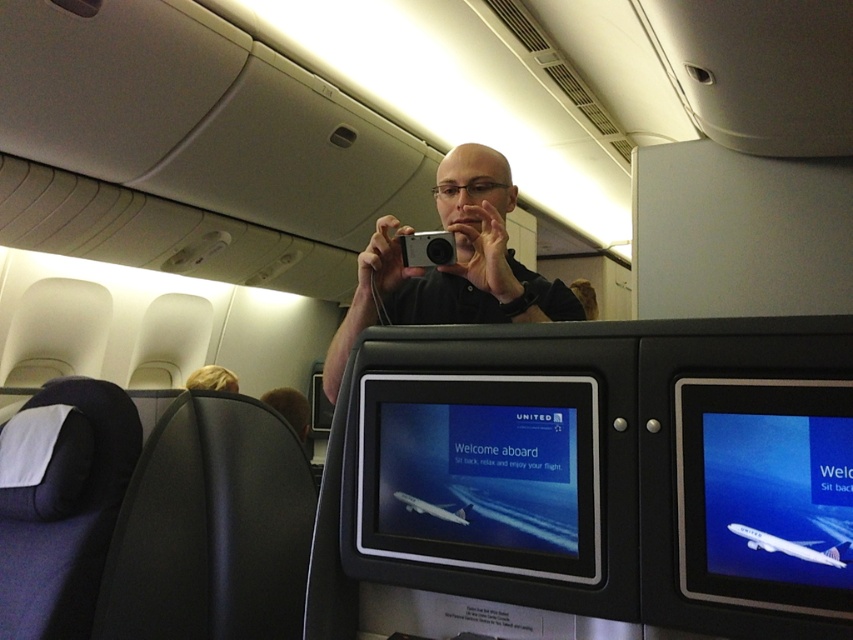
Question: Among these objects, which one is nearest to the camera?

Choices:
 (A) silver metallic camera at center
 (B) black matte camera at center
 (C) blue glossy airplane at center
 (D) white glossy airplane at upper center

Answer: (C)

Question: Does black matte camera at center have a lesser width compared to white glossy airplane at upper center?

Choices:
 (A) yes
 (B) no

Answer: (B)

Question: Which point is closer to the camera?

Choices:
 (A) silver metallic camera at center
 (B) blue glossy screen at center
 (C) white glossy airplane at center

Answer: (B)

Question: Can you confirm if blue glossy screen at center is bigger than silver metallic camera at center?

Choices:
 (A) no
 (B) yes

Answer: (B)

Question: Among these points, which one is nearest to the camera?

Choices:
 (A) (444, 234)
 (B) (505, 173)
 (C) (830, 573)

Answer: (C)

Question: Can you confirm if silver metallic camera at center is wider than white glossy airplane at center?

Choices:
 (A) no
 (B) yes

Answer: (B)